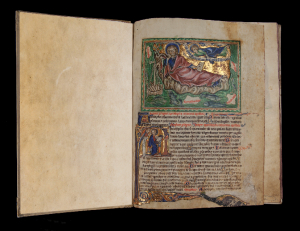
Where is `book`? book is located at coordinates (88, 100).